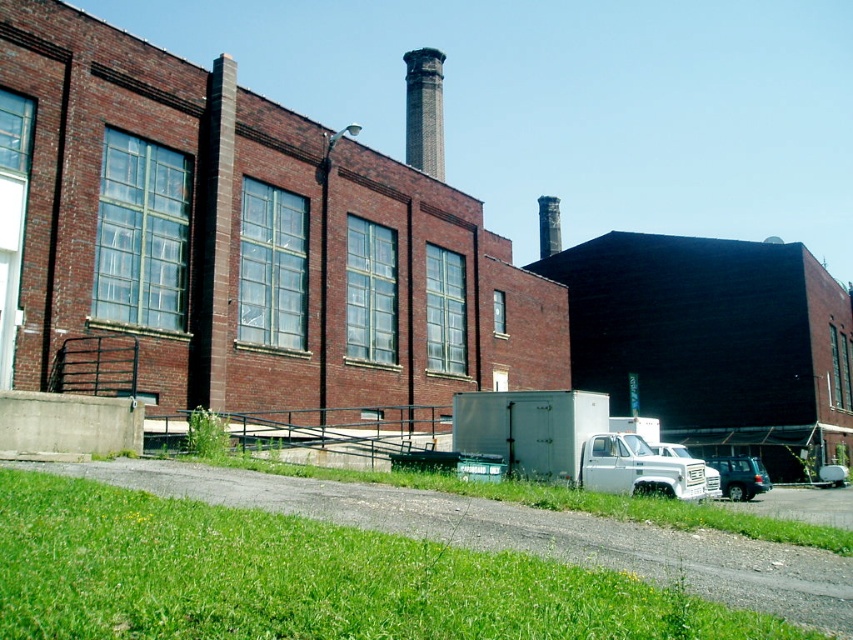
Who is taller, white matte truck at lower right or brick chimney at upper center?

brick chimney at upper center

Where is `white matte truck at lower right`? The width and height of the screenshot is (853, 640). white matte truck at lower right is located at coordinates (572, 444).

Image resolution: width=853 pixels, height=640 pixels. Describe the element at coordinates (572, 444) in the screenshot. I see `white matte truck at lower right` at that location.

This screenshot has height=640, width=853. I want to click on white matte truck at lower right, so click(x=572, y=444).

Who is positioned more to the right, white matte truck at center or matte gray suv at lower right?

Positioned to the right is matte gray suv at lower right.

Is white matte truck at center above matte gray suv at lower right?

Yes.

The height and width of the screenshot is (640, 853). Describe the element at coordinates (643, 468) in the screenshot. I see `white matte truck at center` at that location.

Locate an element on the screen. white matte truck at center is located at coordinates (643, 468).

Is brick at center in front of dark gray stone chimney at upper center?

Yes, it is in front of dark gray stone chimney at upper center.

Can you confirm if brick at center is wider than dark gray stone chimney at upper center?

Yes.

Find the location of `brick at center`. brick at center is located at coordinates (235, 244).